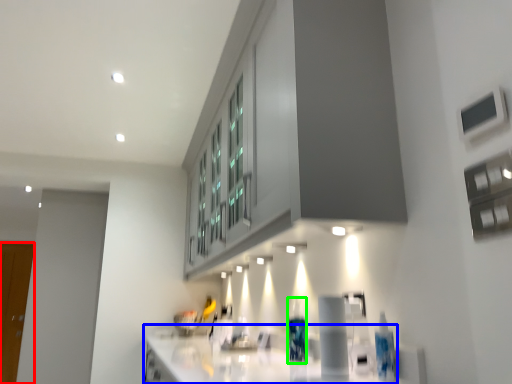
Question: Which object is positioned closest to glass door (highlighted by a red box)? Select from countertop (highlighted by a blue box) and bottle (highlighted by a green box).

Choices:
 (A) countertop
 (B) bottle

Answer: (A)